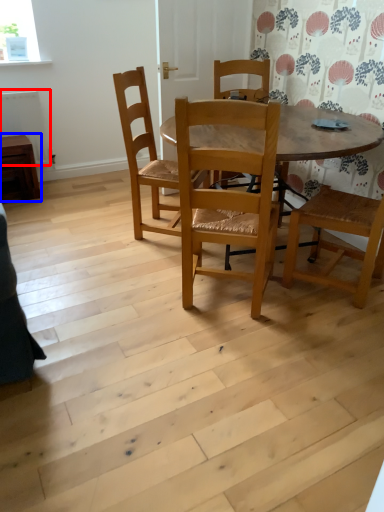
Question: Among these objects, which one is nearest to the camera, radiator (highlighted by a red box) or table (highlighted by a blue box)?

Choices:
 (A) radiator
 (B) table

Answer: (B)